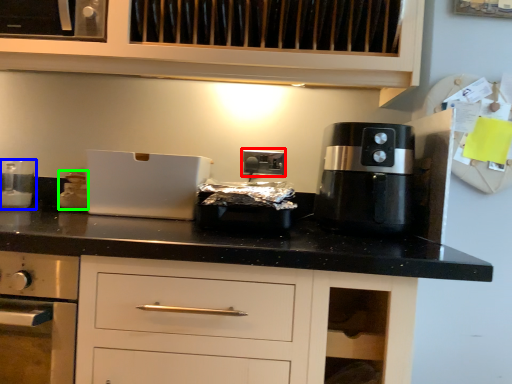
Question: Which is nearer to the electric outlet (highlighted by a red box)? kitchen appliance (highlighted by a blue box) or kitchen appliance (highlighted by a green box).

Choices:
 (A) kitchen appliance
 (B) kitchen appliance

Answer: (B)